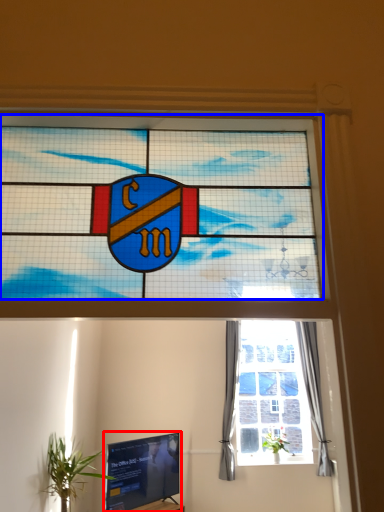
Question: Which point is closer to the camera, television (highlighted by a red box) or window (highlighted by a blue box)?

Choices:
 (A) television
 (B) window

Answer: (B)